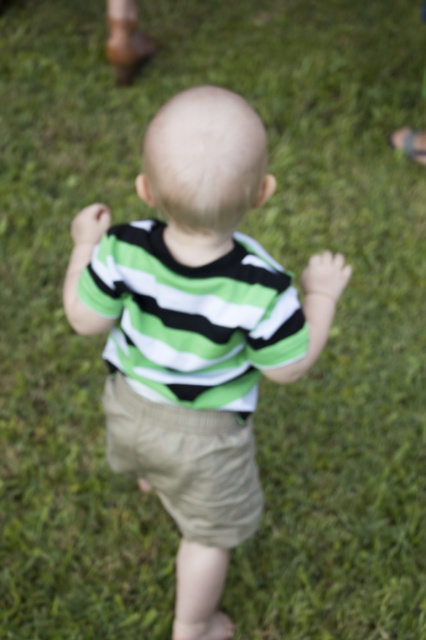
You are a photographer adjusting your camera to focus on the child in the image. Since the green striped shirt at center and the khaki cotton shorts at center are both in the frame, which one will be in focus if you adjust the focus to the closer object?

The green striped shirt at center will be in focus because it is closer to the viewer than the khaki cotton shorts at center.